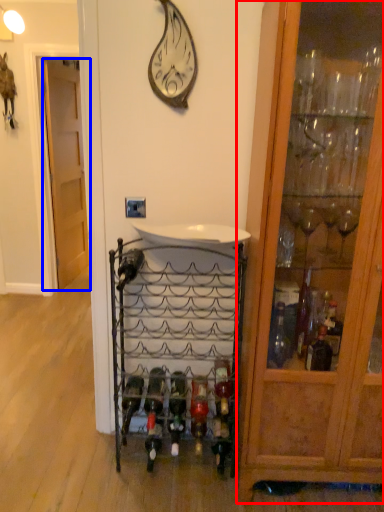
Question: Which of the following is the closest to the observer, cabinetry (highlighted by a red box) or door (highlighted by a blue box)?

Choices:
 (A) cabinetry
 (B) door

Answer: (A)